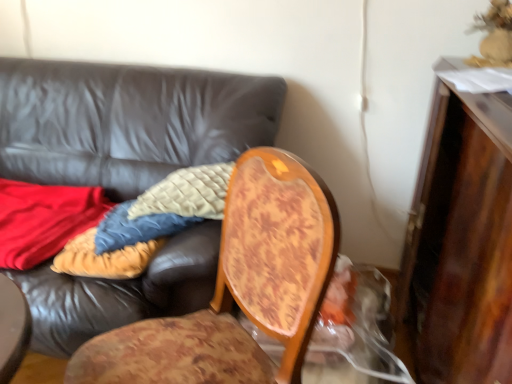
Question: Considering the relative sizes of wooden chair at center and wooden dresser at right in the image provided, is wooden chair at center shorter than wooden dresser at right?

Choices:
 (A) no
 (B) yes

Answer: (B)

Question: From the image's perspective, is wooden chair at center below wooden dresser at right?

Choices:
 (A) no
 (B) yes

Answer: (B)

Question: Does wooden chair at center come behind wooden dresser at right?

Choices:
 (A) no
 (B) yes

Answer: (B)

Question: Is wooden chair at center thinner than wooden dresser at right?

Choices:
 (A) yes
 (B) no

Answer: (A)

Question: Can you confirm if wooden chair at center is smaller than wooden dresser at right?

Choices:
 (A) yes
 (B) no

Answer: (A)

Question: In the image, is wooden dresser at right positioned in front of or behind leather couch at center?

Choices:
 (A) front
 (B) behind

Answer: (A)

Question: Based on their positions, is wooden dresser at right located to the left or right of leather couch at center?

Choices:
 (A) right
 (B) left

Answer: (A)

Question: In terms of width, does wooden dresser at right look wider or thinner when compared to leather couch at center?

Choices:
 (A) wide
 (B) thin

Answer: (B)

Question: Is wooden dresser at right spatially inside leather couch at center, or outside of it?

Choices:
 (A) outside
 (B) inside

Answer: (A)

Question: Looking at their shapes, would you say wooden dresser at right is wider or thinner than wooden chair at center?

Choices:
 (A) thin
 (B) wide

Answer: (B)

Question: In terms of height, does wooden dresser at right look taller or shorter compared to wooden chair at center?

Choices:
 (A) tall
 (B) short

Answer: (A)

Question: Is point (497, 238) positioned closer to the camera than point (117, 380)?

Choices:
 (A) closer
 (B) farther

Answer: (A)

Question: From the image's perspective, is wooden dresser at right above or below wooden chair at center?

Choices:
 (A) below
 (B) above

Answer: (B)

Question: Visually, is leather couch at center positioned to the left or to the right of wooden chair at center?

Choices:
 (A) left
 (B) right

Answer: (A)

Question: Is leather couch at center in front of or behind wooden chair at center in the image?

Choices:
 (A) behind
 (B) front

Answer: (A)